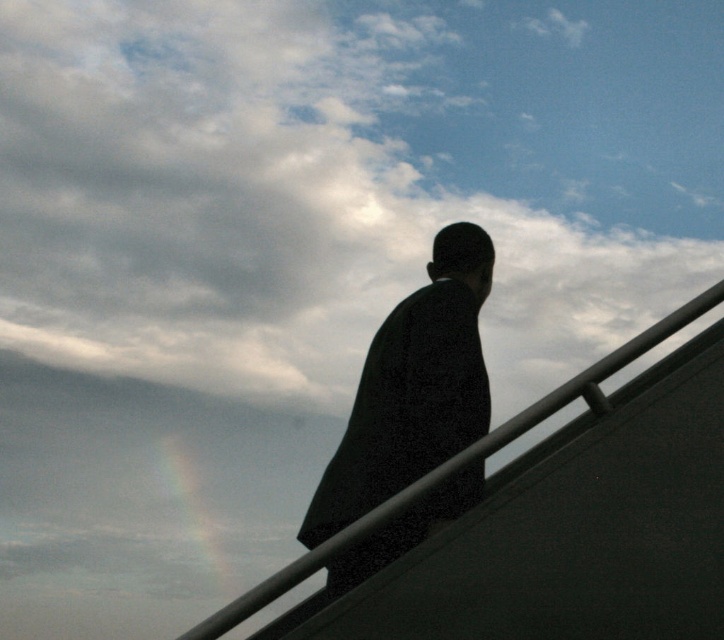
You are standing on a staircase or ramp and looking at the cloudy sky at upper center. If you need to reach an object that is 12 meters away, can you touch it with a 0.5 meter long stick?

The cloudy sky at upper center is 11.66 meters away from the viewer. Since the object is 12 meters away, which is 0.34 meters farther than the cloudy sky at upper center, you cannot touch it with a 0.5 meter long stick.

You are a drone operator trying to capture a photo of the cloudy sky at upper center and the black matte suit at center. Your drone can only fly up to 7 meters. Can your drone reach both objects from your current position?

The cloudy sky at upper center and black matte suit at center are 7.43 meters apart from each other. Since the drone can only fly up to 7 meters, it cannot reach both objects from the current position as the distance exceeds the maximum range.